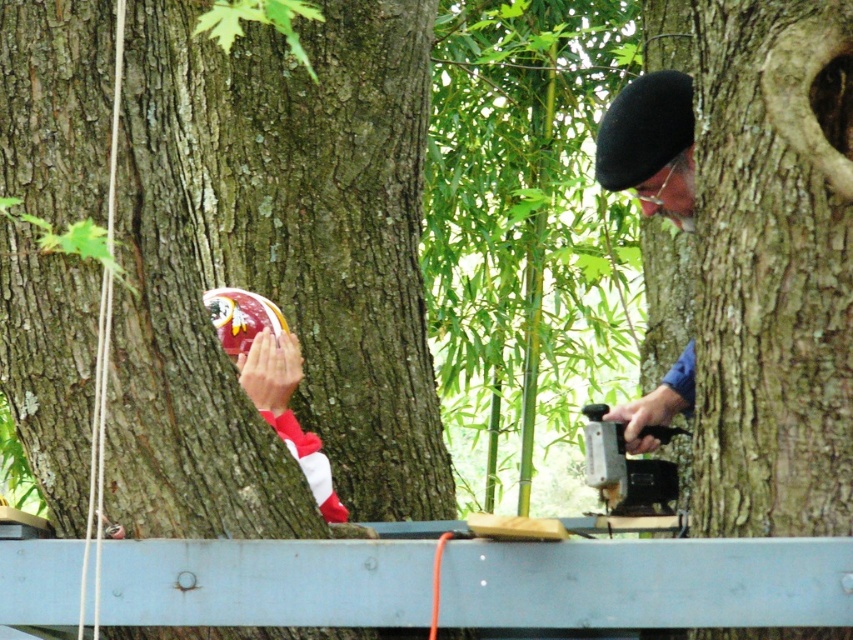
Question: Can you confirm if matte black beret at upper right is wider than metallic gray stapler at right?

Choices:
 (A) yes
 (B) no

Answer: (B)

Question: Estimate the real-world distances between objects in this image. Which object is farther from the metallic gray stapler at right?

Choices:
 (A) rough bark tree at center
 (B) smooth gray plank at center

Answer: (B)

Question: Which of the following is the closest to the observer?

Choices:
 (A) metallic gray stapler at right
 (B) smooth gray plank at center

Answer: (B)

Question: Which object is the closest to the rough bark tree at center?

Choices:
 (A) smooth gray plank at center
 (B) brown rough bark at center
 (C) matte black beret at upper right

Answer: (C)

Question: Is brown rough bark at center below smooth gray plank at center?

Choices:
 (A) yes
 (B) no

Answer: (B)

Question: Considering the relative positions of smooth gray plank at center and matte black beret at upper right in the image provided, where is smooth gray plank at center located with respect to matte black beret at upper right?

Choices:
 (A) above
 (B) below

Answer: (B)